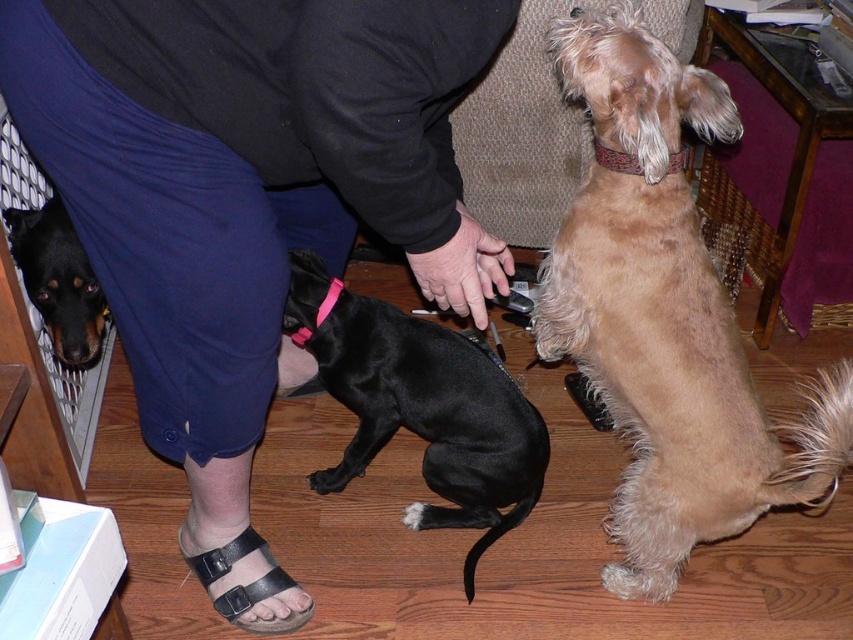
Question: Considering the relative positions of light brown fur at upper right and black smooth dog at center in the image provided, where is light brown fur at upper right located with respect to black smooth dog at center?

Choices:
 (A) above
 (B) below

Answer: (A)

Question: Is light brown fur at upper right bigger than black smooth dog at center?

Choices:
 (A) no
 (B) yes

Answer: (B)

Question: Is black shiny dog at lower left below black leather sandal at lower left?

Choices:
 (A) yes
 (B) no

Answer: (B)

Question: Which object is positioned closest to the black leather sandal at lower left?

Choices:
 (A) light brown fur at upper right
 (B) black cotton pants at lower left
 (C) black shiny dog at lower left
 (D) black smooth dog at center

Answer: (D)

Question: Among these points, which one is farthest from the camera?

Choices:
 (A) (305, 618)
 (B) (636, 518)

Answer: (A)

Question: Which point appears farthest from the camera in this image?

Choices:
 (A) (120, 202)
 (B) (44, 285)
 (C) (280, 625)

Answer: (B)